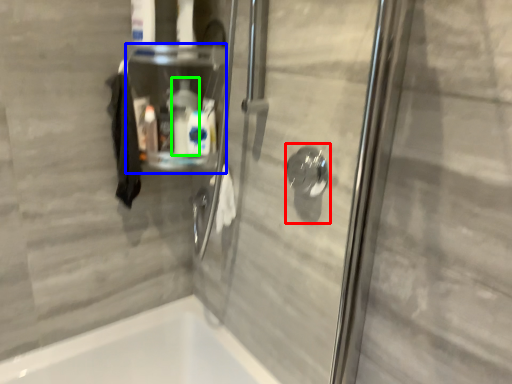
Question: Estimate the real-world distances between objects in this image. Which object is closer to shower (highlighted by a red box), shelf (highlighted by a blue box) or cleaning product (highlighted by a green box)?

Choices:
 (A) shelf
 (B) cleaning product

Answer: (B)